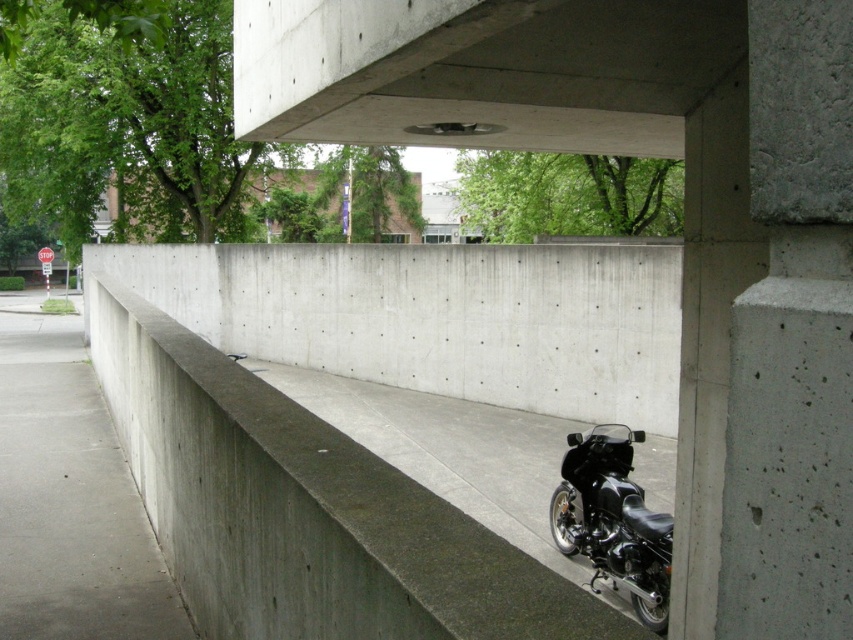
You are a delivery person who needs to park your motorcycle near the stop sign. The concrete at lower right and the black matte motorcycle at lower right are both in your view. Which location is higher up from the ground?

The concrete at lower right is located above the black matte motorcycle at lower right, so the concrete at lower right is higher up from the ground.

You are standing at the point marked by the coordinate point (x=305, y=509) under the overpass. Which direction should you walk to reach the sidewalk on the left side of the frame?

The sidewalk is on the left side of the frame, so you should walk towards the left from the point (x=305, y=509) to reach it.